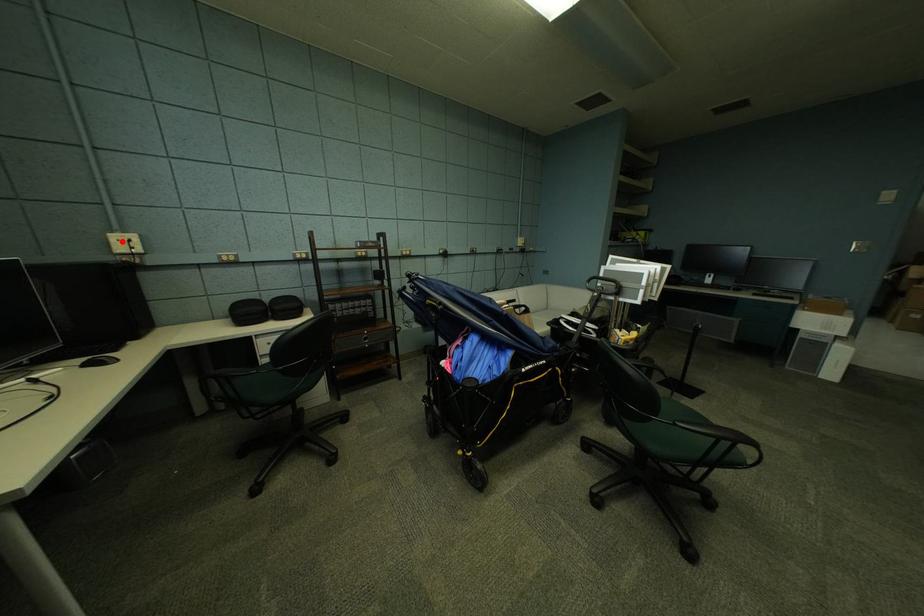
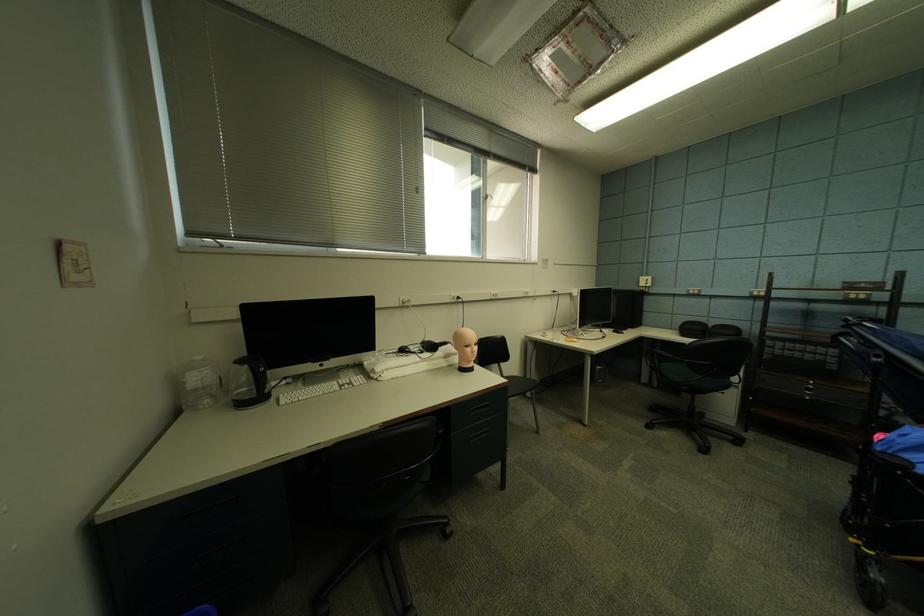
Locate, in the second image, the point that corresponds to the highlighted location in the first image.

(650, 282)